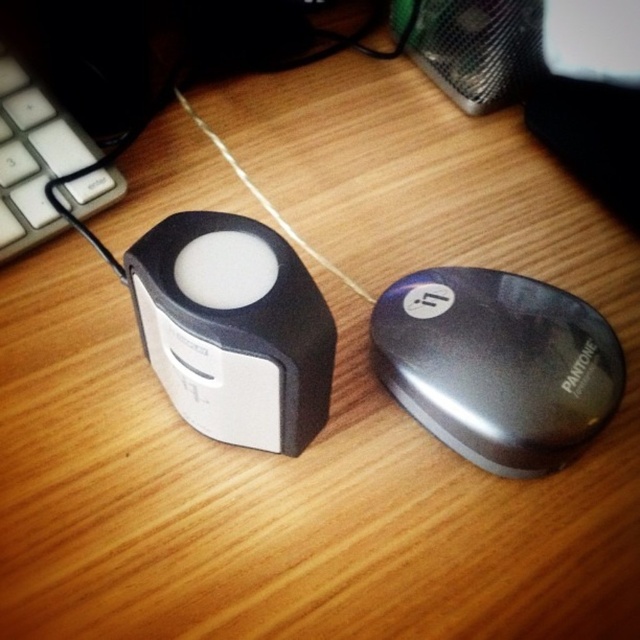
Which is above, matte black speaker at center or white matte string at center?

Positioned higher is white matte string at center.

I want to click on matte black speaker at center, so click(x=234, y=330).

The height and width of the screenshot is (640, 640). Describe the element at coordinates (234, 330) in the screenshot. I see `matte black speaker at center` at that location.

This screenshot has height=640, width=640. I want to click on matte black speaker at center, so click(234, 330).

What do you see at coordinates (497, 365) in the screenshot?
I see `satin black mouse at center` at bounding box center [497, 365].

Who is taller, satin black mouse at center or matte black speaker at center?

With more height is matte black speaker at center.

The height and width of the screenshot is (640, 640). In order to click on satin black mouse at center in this screenshot , I will do `click(497, 365)`.

Is point (538, 294) farther from camera compared to point (289, 234)?

No.

This screenshot has width=640, height=640. I want to click on satin black mouse at center, so click(497, 365).